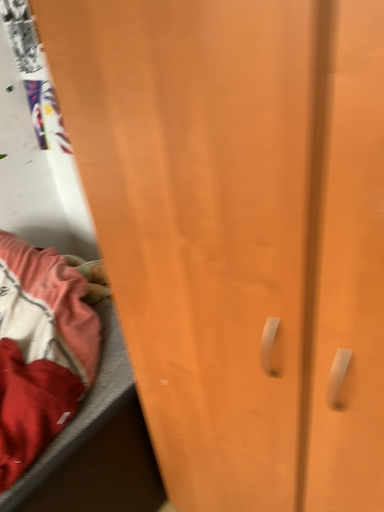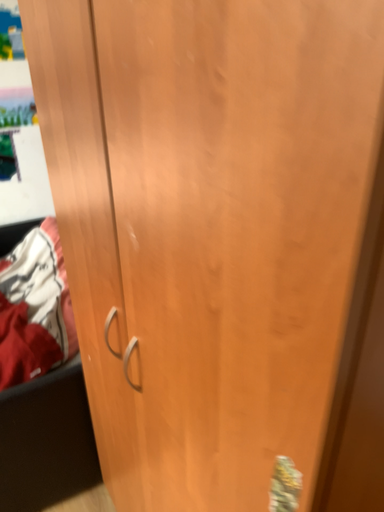
Question: How did the camera likely rotate when shooting the video?

Choices:
 (A) rotated upward
 (B) rotated downward

Answer: (A)